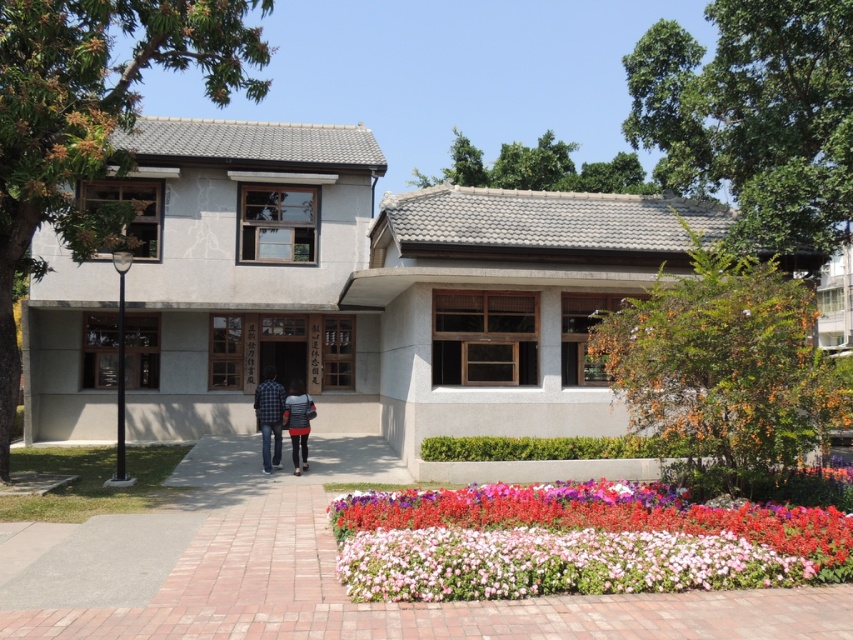
You are standing in front of the building and want to take a photo of the plaid shirt at center without the multicolored floral carpet at lower center appearing in the background. How should you position yourself?

Move behind the multicolored floral carpet at lower center so that the plaid shirt at center is in front of the floral carpet, blocking it from view.

You are a photographer standing in front of the building. You want to capture a photo of the striped fabric shirt at center and the multicolored floral carpet at lower center. Which object should you focus on first if you want the one closer to you to be in sharp focus?

The striped fabric shirt at center should be focused on first because it is closer to you than the multicolored floral carpet at lower center, which is positioned behind it.